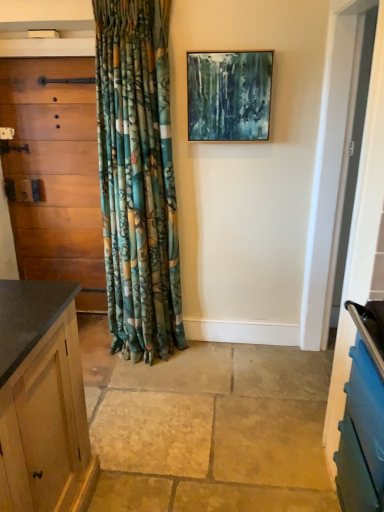
Question: From the image's perspective, is wooden cabinet at left located above or below metallic gold picture frame at upper center?

Choices:
 (A) above
 (B) below

Answer: (B)

Question: Would you say wooden cabinet at left is to the left or to the right of metallic gold picture frame at upper center in the picture?

Choices:
 (A) right
 (B) left

Answer: (B)

Question: Considering the positions of point (94, 224) and point (240, 90), is point (94, 224) closer or farther from the camera than point (240, 90)?

Choices:
 (A) closer
 (B) farther

Answer: (B)

Question: Is metallic gold picture frame at upper center taller or shorter than wooden cabinet at left?

Choices:
 (A) short
 (B) tall

Answer: (A)

Question: Is metallic gold picture frame at upper center bigger or smaller than wooden cabinet at left?

Choices:
 (A) small
 (B) big

Answer: (A)

Question: Is point (244, 82) closer or farther from the camera than point (99, 267)?

Choices:
 (A) closer
 (B) farther

Answer: (A)

Question: Is metallic gold picture frame at upper center inside or outside of wooden cabinet at left?

Choices:
 (A) inside
 (B) outside

Answer: (B)